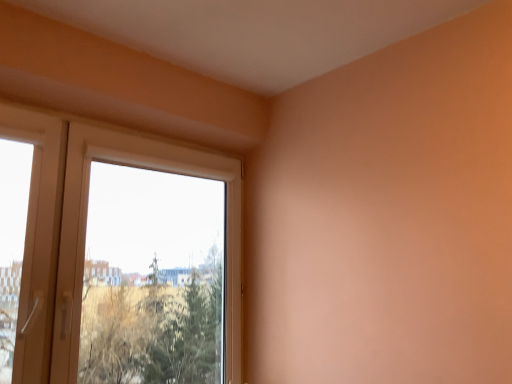
Question: Is white glossy door at left far from white plastic window at upper left?

Choices:
 (A) yes
 (B) no

Answer: (B)

Question: Considering the relative sizes of white glossy door at left and white plastic window at upper left in the image provided, is white glossy door at left thinner than white plastic window at upper left?

Choices:
 (A) yes
 (B) no

Answer: (A)

Question: Is white glossy door at left at the left side of white plastic window at upper left?

Choices:
 (A) yes
 (B) no

Answer: (A)

Question: Is white glossy door at left facing towards white plastic window at upper left?

Choices:
 (A) yes
 (B) no

Answer: (B)

Question: Considering the relative sizes of white glossy door at left and white plastic window at upper left in the image provided, is white glossy door at left smaller than white plastic window at upper left?

Choices:
 (A) yes
 (B) no

Answer: (A)

Question: From the image's perspective, is white glossy door at left on white plastic window at upper left?

Choices:
 (A) no
 (B) yes

Answer: (B)

Question: Can you confirm if white plastic window at upper left is smaller than white glossy door at left?

Choices:
 (A) no
 (B) yes

Answer: (A)

Question: From a real-world perspective, is white plastic window at upper left over white glossy door at left?

Choices:
 (A) no
 (B) yes

Answer: (A)

Question: Is white glossy door at left completely or partially inside white plastic window at upper left?

Choices:
 (A) no
 (B) yes

Answer: (A)

Question: Does white plastic window at upper left appear on the right side of white glossy door at left?

Choices:
 (A) yes
 (B) no

Answer: (A)

Question: From a real-world perspective, is white plastic window at upper left under white glossy door at left?

Choices:
 (A) yes
 (B) no

Answer: (A)

Question: Is white plastic window at upper left wider than white glossy door at left?

Choices:
 (A) yes
 (B) no

Answer: (A)

Question: Considering their positions, is white glossy door at left located in front of or behind white plastic window at upper left?

Choices:
 (A) behind
 (B) front

Answer: (B)